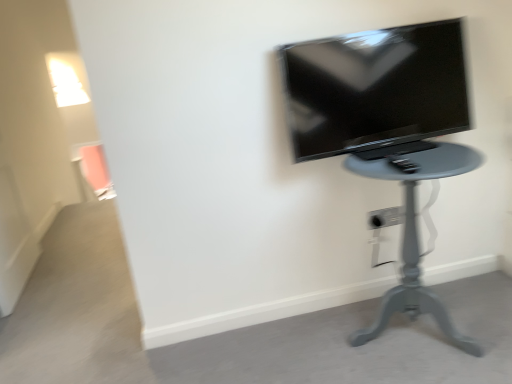
Question: From a real-world perspective, is white plastic electric outlet at lower center beneath matte black tv at upper right?

Choices:
 (A) no
 (B) yes

Answer: (B)

Question: From a real-world perspective, does white plastic electric outlet at lower center stand above matte black tv at upper right?

Choices:
 (A) yes
 (B) no

Answer: (B)

Question: Is white plastic electric outlet at lower center not near matte black tv at upper right?

Choices:
 (A) no
 (B) yes

Answer: (A)

Question: Can we say white plastic electric outlet at lower center lies outside matte black tv at upper right?

Choices:
 (A) no
 (B) yes

Answer: (B)

Question: From the image's perspective, is white plastic electric outlet at lower center on top of matte black tv at upper right?

Choices:
 (A) yes
 (B) no

Answer: (B)

Question: Is matte black tv at upper right taller or shorter than matte gray table at center?

Choices:
 (A) short
 (B) tall

Answer: (A)

Question: From the image's perspective, is matte black tv at upper right above or below matte gray table at center?

Choices:
 (A) above
 (B) below

Answer: (A)

Question: Would you say matte black tv at upper right is inside or outside matte gray table at center?

Choices:
 (A) inside
 (B) outside

Answer: (B)

Question: Does point tap(380, 43) appear closer or farther from the camera than point tap(451, 340)?

Choices:
 (A) closer
 (B) farther

Answer: (A)

Question: Considering the positions of white plastic electric outlet at lower center and matte gray table at center in the image, is white plastic electric outlet at lower center taller or shorter than matte gray table at center?

Choices:
 (A) tall
 (B) short

Answer: (B)

Question: Is white plastic electric outlet at lower center inside the boundaries of matte gray table at center, or outside?

Choices:
 (A) outside
 (B) inside

Answer: (A)

Question: Is white plastic electric outlet at lower center in front of or behind matte gray table at center in the image?

Choices:
 (A) behind
 (B) front

Answer: (A)

Question: Looking at the image, does white plastic electric outlet at lower center seem bigger or smaller compared to matte gray table at center?

Choices:
 (A) big
 (B) small

Answer: (B)

Question: In terms of size, does matte gray table at center appear bigger or smaller than white plastic electric outlet at lower center?

Choices:
 (A) small
 (B) big

Answer: (B)

Question: Considering the positions of point (394, 294) and point (378, 221), is point (394, 294) closer or farther from the camera than point (378, 221)?

Choices:
 (A) farther
 (B) closer

Answer: (B)